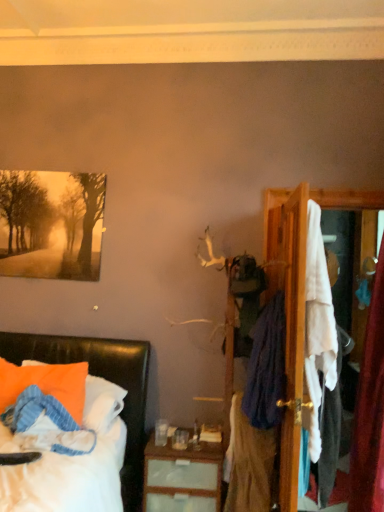
Question: From a real-world perspective, relative to matte black bed at lower left, is velvety purple scarf at right, the second clothing when ordered from top to bottom, vertically above or below?

Choices:
 (A) above
 (B) below

Answer: (A)

Question: Is velvety purple scarf at right, which appears as the first clothing when ordered from the bottom, taller or shorter than matte black bed at lower left?

Choices:
 (A) short
 (B) tall

Answer: (A)

Question: Which is farther from the wooden dresser at right?

Choices:
 (A) orange fabric pillow at lower left
 (B) velvety purple scarf at right, the second clothing when ordered from top to bottom
 (C) dark blue fabric at right, the 1th clothing positioned from the top
 (D) matte black bed at lower left
 (E) matte paper painting at upper left

Answer: (E)

Question: Estimate the real-world distances between objects in this image. Which object is farther from the dark blue fabric at right, the second clothing when ordered from bottom to top?

Choices:
 (A) wooden dresser at right
 (B) velvety purple scarf at right, which appears as the first clothing when ordered from the bottom
 (C) matte paper painting at upper left
 (D) matte black bed at lower left
 (E) orange fabric pillow at lower left

Answer: (C)